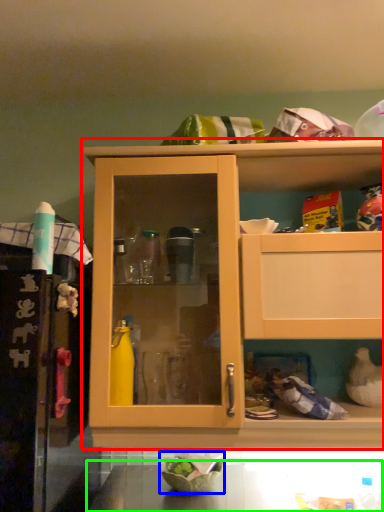
Question: Considering the real-world distances, which object is closest to cabinetry (highlighted by a red box)? bowl (highlighted by a blue box) or counter top (highlighted by a green box).

Choices:
 (A) bowl
 (B) counter top

Answer: (B)